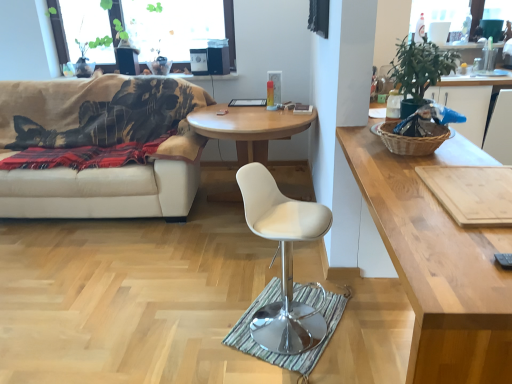
Question: Would you consider wooden round table at center, which ranks as the first coffee table in back-to-front order, to be distant from brown woven picnic basket at right?

Choices:
 (A) yes
 (B) no

Answer: (A)

Question: Can you confirm if wooden round table at center, the second coffee table viewed from the right, is bigger than brown woven picnic basket at right?

Choices:
 (A) no
 (B) yes

Answer: (B)

Question: Considering the relative sizes of wooden round table at center, the second coffee table viewed from the right, and brown woven picnic basket at right in the image provided, is wooden round table at center, the second coffee table viewed from the right, taller than brown woven picnic basket at right?

Choices:
 (A) yes
 (B) no

Answer: (A)

Question: Considering the relative sizes of wooden round table at center, the second coffee table viewed from the right, and brown woven picnic basket at right in the image provided, is wooden round table at center, the second coffee table viewed from the right, wider than brown woven picnic basket at right?

Choices:
 (A) no
 (B) yes

Answer: (B)

Question: Is wooden round table at center, the 1th coffee table viewed from the left, looking in the opposite direction of brown woven picnic basket at right?

Choices:
 (A) yes
 (B) no

Answer: (B)

Question: Would you say wooden cutting board at right is to the left or to the right of green leafy plant at upper right in the picture?

Choices:
 (A) left
 (B) right

Answer: (A)

Question: From a real-world perspective, relative to green leafy plant at upper right, is wooden cutting board at right vertically above or below?

Choices:
 (A) below
 (B) above

Answer: (A)

Question: Considering the positions of wooden cutting board at right and green leafy plant at upper right in the image, is wooden cutting board at right bigger or smaller than green leafy plant at upper right?

Choices:
 (A) small
 (B) big

Answer: (A)

Question: Does point (471, 223) appear closer or farther from the camera than point (425, 57)?

Choices:
 (A) farther
 (B) closer

Answer: (B)

Question: Looking at their shapes, would you say white leather stool at center is wider or thinner than green leafy plant at upper right?

Choices:
 (A) thin
 (B) wide

Answer: (B)

Question: In the image, is white leather stool at center positioned in front of or behind green leafy plant at upper right?

Choices:
 (A) front
 (B) behind

Answer: (A)

Question: Which is correct: white leather stool at center is inside green leafy plant at upper right, or outside of it?

Choices:
 (A) inside
 (B) outside

Answer: (B)

Question: Does point (274, 228) appear closer or farther from the camera than point (406, 81)?

Choices:
 (A) closer
 (B) farther

Answer: (A)

Question: From a real-world perspective, is wooden cutting board at right above or below beige fabric couch at left?

Choices:
 (A) above
 (B) below

Answer: (A)

Question: Would you say wooden cutting board at right is to the left or to the right of beige fabric couch at left in the picture?

Choices:
 (A) right
 (B) left

Answer: (A)